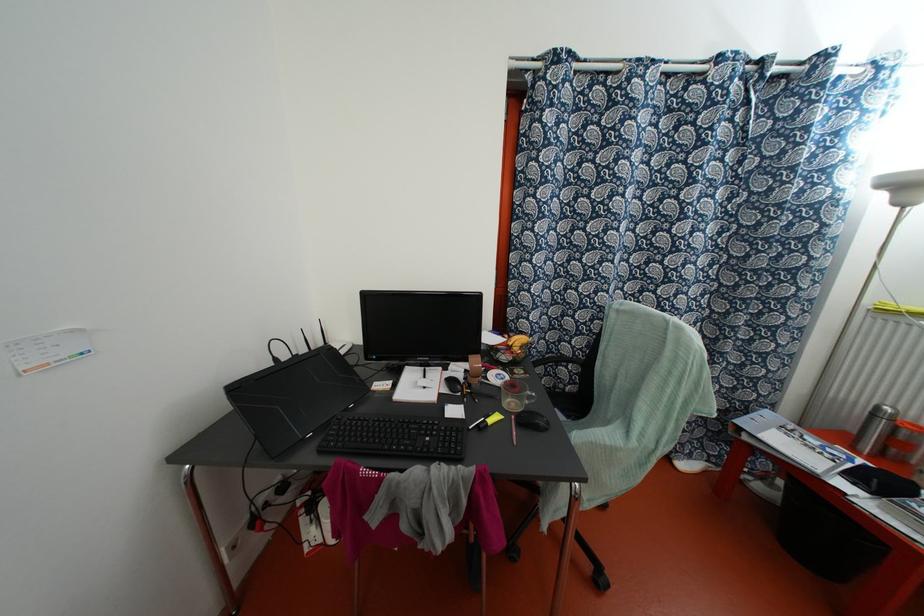
The location [513,428] corresponds to which object?

It corresponds to the pink pen in the image.